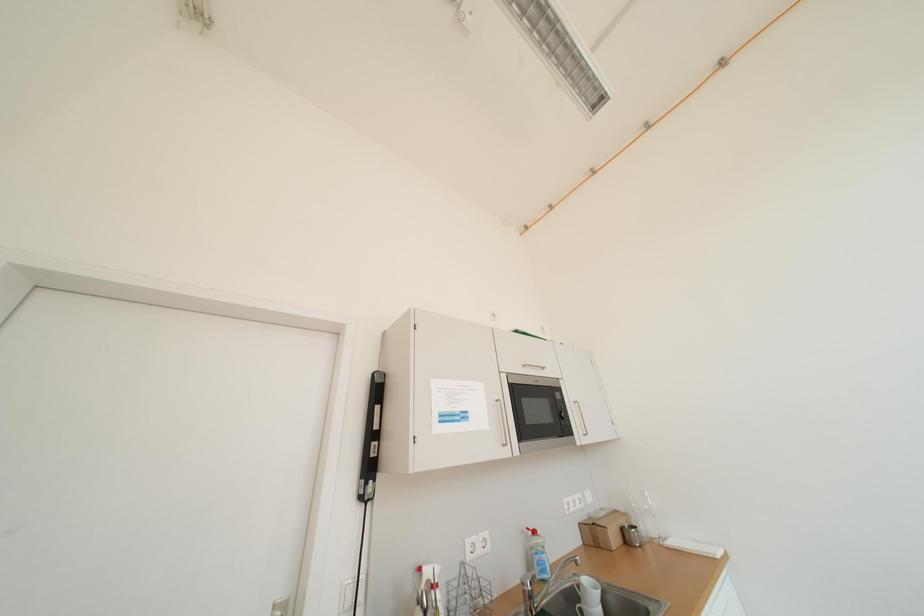
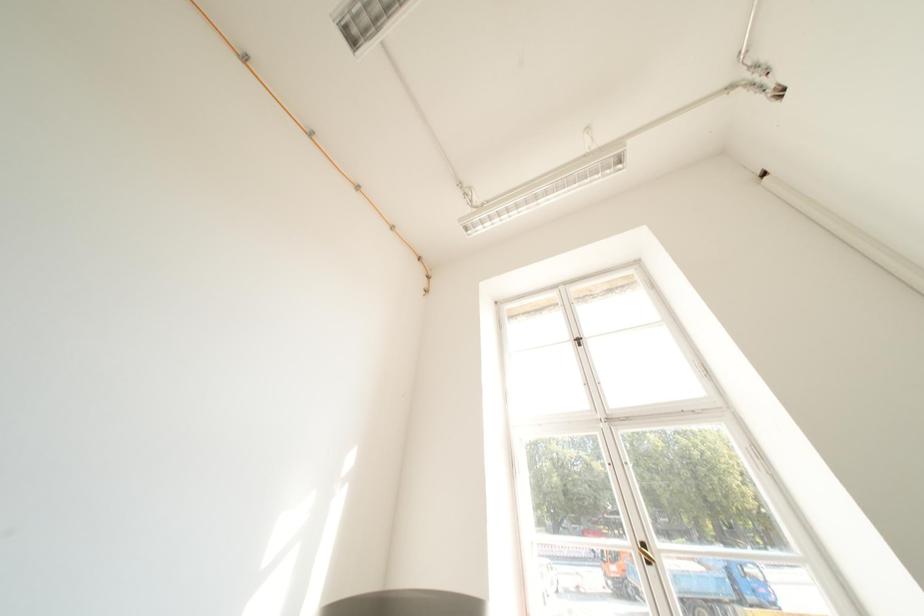
The first image is from the beginning of the video and the second image is from the end. How did the camera likely rotate when shooting the video?

The rotation direction of the camera is right-up.